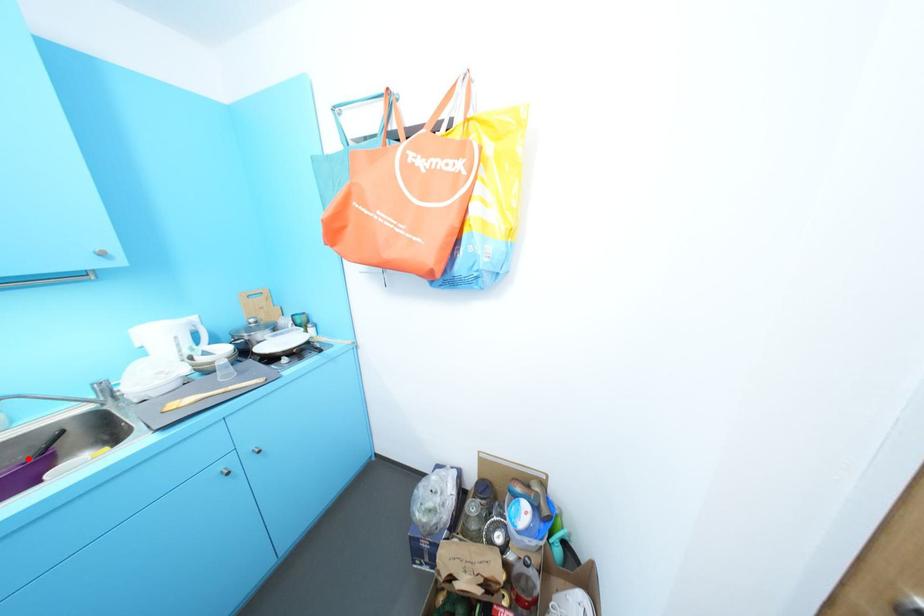
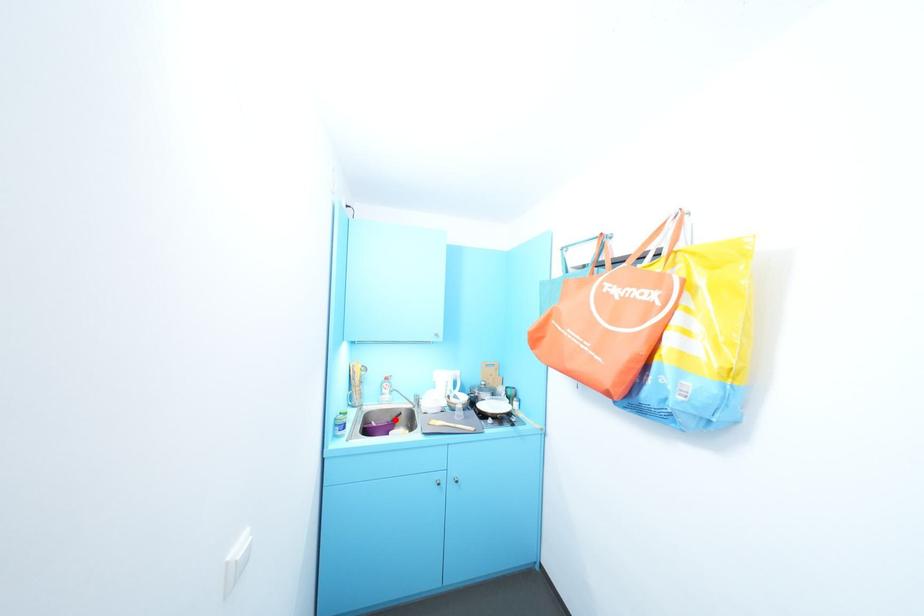
I am providing you with two images of the same scene from different viewpoints. A red point is marked on the first image and another point is marked on the second image. Do the highlighted points in image1 and image2 indicate the same real-world spot?

Yes